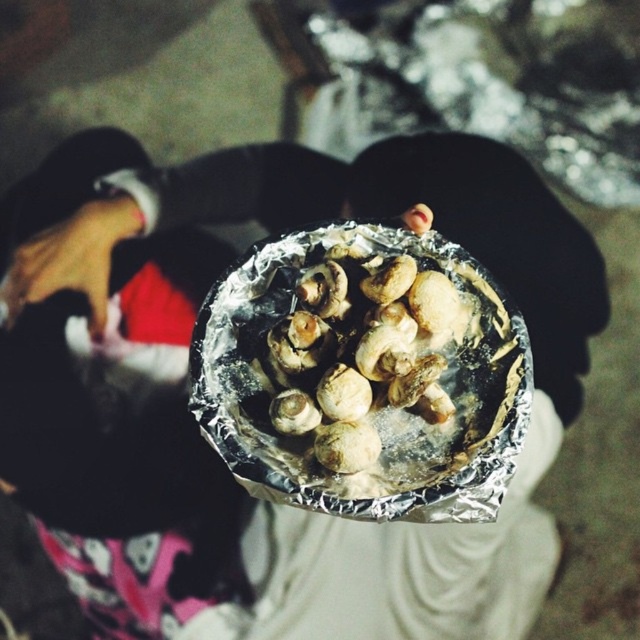
Question: Does white matte mushrooms at center appear on the right side of smooth skin hand at lower left?

Choices:
 (A) no
 (B) yes

Answer: (B)

Question: Considering the relative positions of white matte mushrooms at center and smooth skin hand at lower left in the image provided, where is white matte mushrooms at center located with respect to smooth skin hand at lower left?

Choices:
 (A) below
 (B) above

Answer: (A)

Question: Which object appears closest to the camera in this image?

Choices:
 (A) smooth skin hand at lower left
 (B) white matte mushrooms at center

Answer: (B)

Question: Where is white matte mushrooms at center located in relation to smooth skin hand at lower left in the image?

Choices:
 (A) above
 (B) below

Answer: (B)